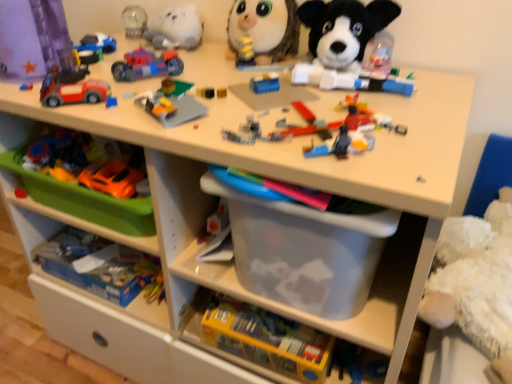
Find the location of a particular element. vacant space behind translucent plastic bricks at center, which is counted as the fourth toy, starting from the bottom is located at coordinates (287, 84).